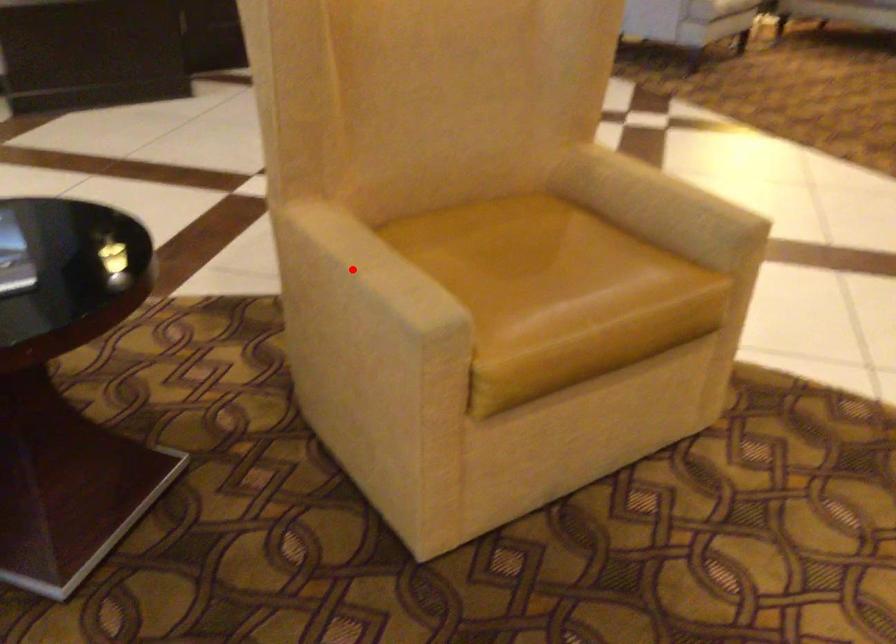
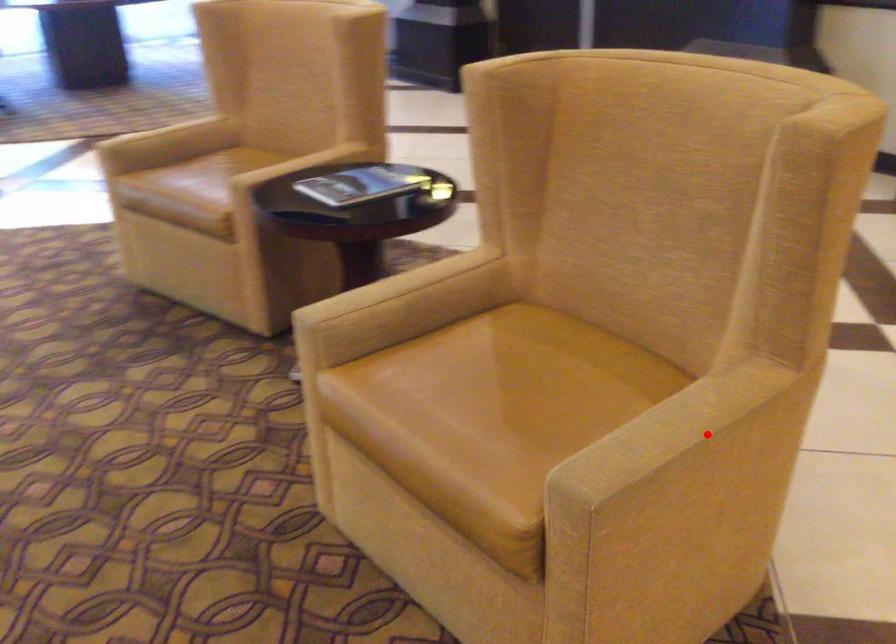
I am providing you with two images of the same scene from different viewpoints. A red point is marked on the first image and another point is marked on the second image. Are the points marked in image1 and image2 representing the same 3D position?

No